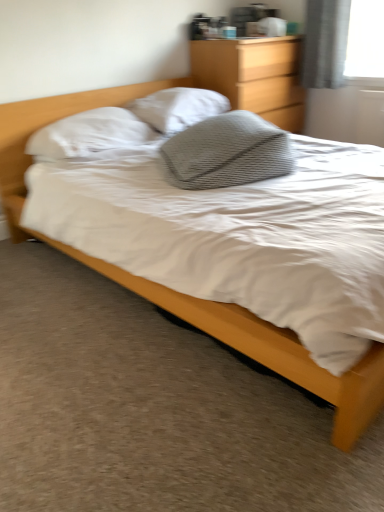
Question: Relative to white textured pillow at center, arranged as the 1th pillow when viewed from the back, is white soft pillow at upper left, which ranks as the 2th pillow in front-to-back order, in front or behind?

Choices:
 (A) behind
 (B) front

Answer: (B)

Question: From a real-world perspective, relative to white textured pillow at center, arranged as the 1th pillow when viewed from the back, is white soft pillow at upper left, which ranks as the 2th pillow in front-to-back order, vertically above or below?

Choices:
 (A) below
 (B) above

Answer: (A)

Question: Considering the real-world distances, which object is closest to the wooden dresser at upper center?

Choices:
 (A) white textured pillow at center, which is the 3th pillow in front-to-back order
 (B) gray textured pillow at center, which is counted as the 1th pillow, starting from the front
 (C) white soft pillow at upper left, which ranks as the 2th pillow in front-to-back order
 (D) matte wood bed at center

Answer: (A)

Question: Estimate the real-world distances between objects in this image. Which object is farther from the gray textured pillow at center, the third pillow when ordered from back to front?

Choices:
 (A) white textured pillow at center, which is the 3th pillow in front-to-back order
 (B) matte wood bed at center
 (C) wooden dresser at upper center
 (D) white soft pillow at upper left, which is counted as the 2th pillow, starting from the back

Answer: (C)